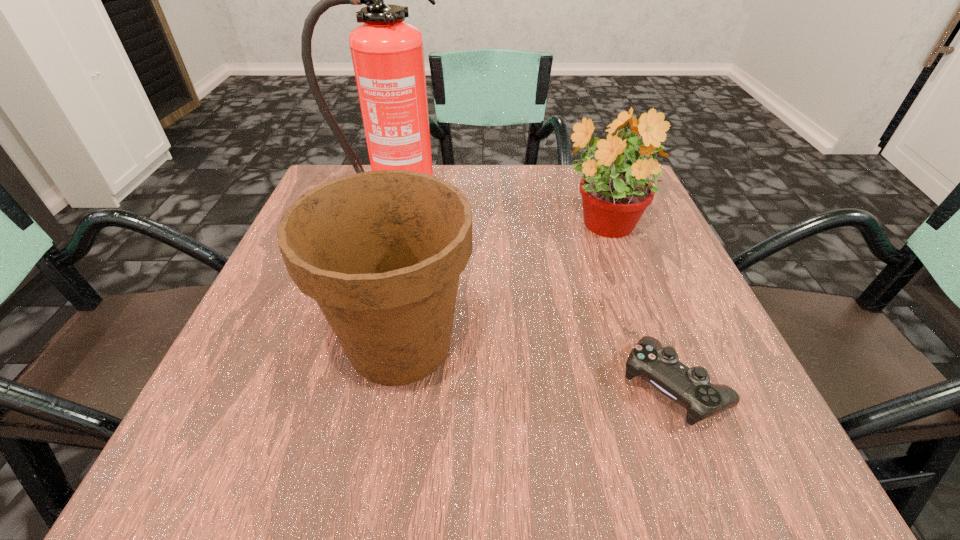
Identify which object is the second closest to the fire extinguisher. Please provide its 2D coordinates. Your answer should be formatted as a tuple, i.e. [(x, y)], where the tuple contains the x and y coordinates of a point satisfying the conditions above.

[(615, 194)]

Find the location of a particular element. This screenshot has height=540, width=960. object that stands as the third closest to the nearer flowerpot is located at coordinates (689, 387).

The image size is (960, 540). I want to click on vacant point that satisfies the following two spatial constraints: 1. at the nozzle of the control; 2. on the left side of the fire extinguisher, so click(x=346, y=386).

This screenshot has height=540, width=960. Find the location of `free spot that satisfies the following two spatial constraints: 1. at the nozzle of the tallest object; 2. on the left side of the farther flowerpot`. free spot that satisfies the following two spatial constraints: 1. at the nozzle of the tallest object; 2. on the left side of the farther flowerpot is located at coordinates (388, 226).

In order to click on free space that satisfies the following two spatial constraints: 1. on the front side of the farther flowerpot; 2. on the left side of the control in this screenshot , I will do `click(657, 386)`.

This screenshot has width=960, height=540. In order to click on vacant space that satisfies the following two spatial constraints: 1. at the nozzle of the tallest object; 2. on the right side of the control in this screenshot , I will do `click(346, 386)`.

What are the coordinates of `free region that satisfies the following two spatial constraints: 1. at the nozzle of the control; 2. on the left side of the fire extinguisher` in the screenshot? It's located at (346, 386).

What are the coordinates of `vacant space that satisfies the following two spatial constraints: 1. at the nozzle of the right flowerpot; 2. on the left side of the fire extinguisher` in the screenshot? It's located at (388, 226).

Find the location of a particular element. free spot that satisfies the following two spatial constraints: 1. at the nozzle of the nearer flowerpot; 2. on the right side of the fire extinguisher is located at coordinates (356, 344).

Identify the location of free location that satisfies the following two spatial constraints: 1. at the nozzle of the fire extinguisher; 2. on the left side of the shortest object. The height and width of the screenshot is (540, 960). (346, 386).